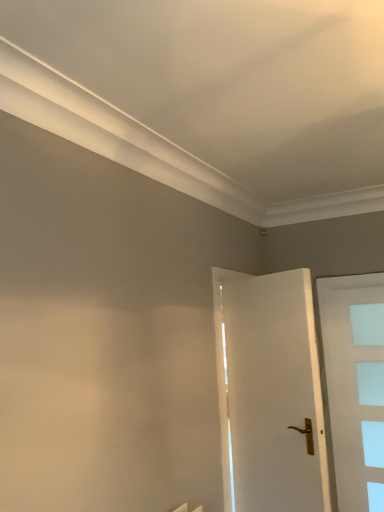
Question: Is white frosted glass door at right, which is counted as the second door, starting from the left, to the left of white glossy door at center, placed as the first door when sorted from left to right, from the viewer's perspective?

Choices:
 (A) no
 (B) yes

Answer: (A)

Question: Is white frosted glass door at right, which appears as the 1th door when viewed from the right, aimed at white glossy door at center, which ranks as the 1th door in front-to-back order?

Choices:
 (A) yes
 (B) no

Answer: (A)

Question: Considering the relative sizes of white frosted glass door at right, which is counted as the second door, starting from the left, and white glossy door at center, positioned as the second door in back-to-front order, in the image provided, is white frosted glass door at right, which is counted as the second door, starting from the left, wider than white glossy door at center, positioned as the second door in back-to-front order,?

Choices:
 (A) no
 (B) yes

Answer: (A)

Question: Is white frosted glass door at right, which is the first door from back to front, thinner than white glossy door at center, positioned as the second door in back-to-front order?

Choices:
 (A) yes
 (B) no

Answer: (A)

Question: Is the position of white frosted glass door at right, which appears as the 1th door when viewed from the right, more distant than that of white glossy door at center, placed as the first door when sorted from left to right?

Choices:
 (A) no
 (B) yes

Answer: (B)

Question: Does white frosted glass door at right, which appears as the 1th door when viewed from the right, have a larger size compared to white glossy door at center, positioned as the second door in back-to-front order?

Choices:
 (A) yes
 (B) no

Answer: (B)

Question: Considering the relative positions of white glossy door at center, which ranks as the 1th door in front-to-back order, and white frosted glass door at right, which appears as the 1th door when viewed from the right, in the image provided, is white glossy door at center, which ranks as the 1th door in front-to-back order, to the left of white frosted glass door at right, which appears as the 1th door when viewed from the right, from the viewer's perspective?

Choices:
 (A) yes
 (B) no

Answer: (A)

Question: Can you confirm if white glossy door at center, placed as the first door when sorted from left to right, is wider than white frosted glass door at right, which appears as the 1th door when viewed from the right?

Choices:
 (A) no
 (B) yes

Answer: (B)

Question: Can you confirm if white glossy door at center, positioned as the second door in back-to-front order, is bigger than white frosted glass door at right, which is the first door from back to front?

Choices:
 (A) yes
 (B) no

Answer: (A)

Question: Is white glossy door at center, placed as the first door when sorted from left to right, closer to camera compared to white frosted glass door at right, which is the first door from back to front?

Choices:
 (A) yes
 (B) no

Answer: (A)

Question: Does white glossy door at center, positioned as the second door in back-to-front order, have a lesser height compared to white frosted glass door at right, which is the first door from back to front?

Choices:
 (A) no
 (B) yes

Answer: (B)

Question: Can you confirm if white glossy door at center, which ranks as the 1th door in front-to-back order, is thinner than white frosted glass door at right, which is counted as the second door, starting from the left?

Choices:
 (A) no
 (B) yes

Answer: (A)

Question: Is white frosted glass door at right, which is the first door from back to front, situated inside white glossy door at center, placed as the first door when sorted from left to right, or outside?

Choices:
 (A) outside
 (B) inside

Answer: (A)